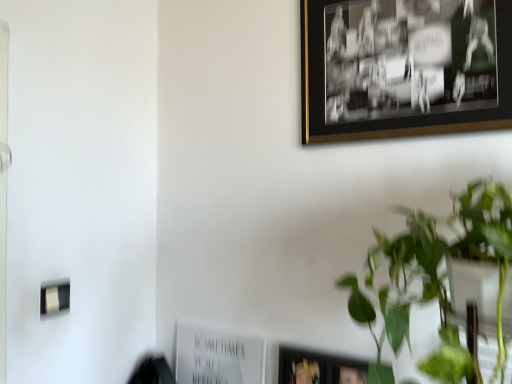
What do you see at coordinates (404, 68) in the screenshot? The width and height of the screenshot is (512, 384). I see `black/golden frame at upper right, marked as the 1th picture frame in a front-to-back arrangement` at bounding box center [404, 68].

What is the approximate width of green leafy plant at upper right?

19.14 inches.

Find the location of `white paper at lower center, the first picture frame from the left`. white paper at lower center, the first picture frame from the left is located at coordinates (218, 357).

From the image's perspective, is black/golden frame at upper right, which ranks as the second picture frame in back-to-front order, located beneath green leafy plant at upper right?

No, from the image's perspective, black/golden frame at upper right, which ranks as the second picture frame in back-to-front order, is not beneath green leafy plant at upper right.

Is black/golden frame at upper right, which ranks as the second picture frame in back-to-front order, shorter than green leafy plant at upper right?

Yes, black/golden frame at upper right, which ranks as the second picture frame in back-to-front order, is shorter than green leafy plant at upper right.

Is point (398, 106) farther from viewer compared to point (499, 196)?

Yes, it is behind point (499, 196).

Is black/golden frame at upper right, acting as the second picture frame starting from the left, far from green leafy plant at upper right?

Actually, black/golden frame at upper right, acting as the second picture frame starting from the left, and green leafy plant at upper right are a little close together.

Is green leafy plant at upper right wider or thinner than white paper at lower center, which is the first picture frame in bottom-to-top order?

green leafy plant at upper right is wider than white paper at lower center, which is the first picture frame in bottom-to-top order.

Are green leafy plant at upper right and white paper at lower center, placed as the 2th picture frame when sorted from right to left, far apart?

green leafy plant at upper right is near white paper at lower center, placed as the 2th picture frame when sorted from right to left, not far away.

Would you say white paper at lower center, marked as the second picture frame in a top-to-bottom arrangement, is part of green leafy plant at upper right's contents?

Actually, white paper at lower center, marked as the second picture frame in a top-to-bottom arrangement, is outside green leafy plant at upper right.

How much distance is there between white paper at lower center, the first picture frame from the left, and green leafy plant at upper right?

white paper at lower center, the first picture frame from the left, is 20.98 inches away from green leafy plant at upper right.

Looking at their sizes, would you say white paper at lower center, which is the first picture frame in bottom-to-top order, is wider or thinner than green leafy plant at upper right?

In the image, white paper at lower center, which is the first picture frame in bottom-to-top order, appears to be more narrow than green leafy plant at upper right.

How different are the orientations of white paper at lower center, which is the first picture frame in bottom-to-top order, and green leafy plant at upper right in degrees?

white paper at lower center, which is the first picture frame in bottom-to-top order, and green leafy plant at upper right are facing 5.29 degrees away from each other.

Are white paper at lower center, the second picture frame when ordered from front to back, and green leafy plant at upper right far apart?

That's not correct — white paper at lower center, the second picture frame when ordered from front to back, is a little close to green leafy plant at upper right.

From a real-world perspective, is green leafy plant at upper right physically located above or below black/golden frame at upper right, which is the second picture frame from bottom to top?

green leafy plant at upper right is below black/golden frame at upper right, which is the second picture frame from bottom to top.

Is green leafy plant at upper right next to black/golden frame at upper right, acting as the second picture frame starting from the left?

green leafy plant at upper right is not next to black/golden frame at upper right, acting as the second picture frame starting from the left, and they're not touching.

Which is behind, green leafy plant at upper right or black/golden frame at upper right, which is the 1th picture frame in top-to-bottom order?

Positioned behind is black/golden frame at upper right, which is the 1th picture frame in top-to-bottom order.

From the image's perspective, is green leafy plant at upper right positioned above or below black/golden frame at upper right, which ranks as the second picture frame in back-to-front order?

From the image's perspective, green leafy plant at upper right appears below black/golden frame at upper right, which ranks as the second picture frame in back-to-front order.

Is black/golden frame at upper right, marked as the 1th picture frame in a front-to-back arrangement, not close to white paper at lower center, the second picture frame when ordered from front to back?

No, black/golden frame at upper right, marked as the 1th picture frame in a front-to-back arrangement, is not far away from white paper at lower center, the second picture frame when ordered from front to back.

Considering the relative sizes of black/golden frame at upper right, which ranks as the second picture frame in back-to-front order, and white paper at lower center, which ranks as the first picture frame in back-to-front order, in the image provided, is black/golden frame at upper right, which ranks as the second picture frame in back-to-front order, shorter than white paper at lower center, which ranks as the first picture frame in back-to-front order,?

No, black/golden frame at upper right, which ranks as the second picture frame in back-to-front order, is not shorter than white paper at lower center, which ranks as the first picture frame in back-to-front order.

Does point (447, 93) come in front of point (204, 371)?

Yes, it is.

Considering the positions of objects black/golden frame at upper right, marked as the 1th picture frame in a front-to-back arrangement, and white paper at lower center, the second picture frame when ordered from front to back, in the image provided, who is more to the left, black/golden frame at upper right, marked as the 1th picture frame in a front-to-back arrangement, or white paper at lower center, the second picture frame when ordered from front to back,?

white paper at lower center, the second picture frame when ordered from front to back, is more to the left.

Which is closer to the camera, (183,367) or (430,68)?

Point (183,367).

Which object is further away from the camera taking this photo, white paper at lower center, which is the first picture frame in bottom-to-top order, or black/golden frame at upper right, marked as the 1th picture frame in a front-to-back arrangement?

white paper at lower center, which is the first picture frame in bottom-to-top order.

From a real-world perspective, does white paper at lower center, the first picture frame from the left, stand above black/golden frame at upper right, which is the second picture frame from bottom to top?

Actually, white paper at lower center, the first picture frame from the left, is physically below black/golden frame at upper right, which is the second picture frame from bottom to top, in the real world.

Based on the photo, is white paper at lower center, which is the first picture frame in bottom-to-top order, thinner than black/golden frame at upper right, acting as the second picture frame starting from the left?

Incorrect, the width of white paper at lower center, which is the first picture frame in bottom-to-top order, is not less than that of black/golden frame at upper right, acting as the second picture frame starting from the left.

Starting from the green leafy plant at upper right, which picture frame is the 1st one behind? Please provide its 2D coordinates.

[(404, 68)]

I want to click on houseplant on the right of white paper at lower center, placed as the 2th picture frame when sorted from right to left, so click(x=443, y=276).

Based on their spatial positions, is black/golden frame at upper right, acting as the second picture frame starting from the left, or white paper at lower center, placed as the 2th picture frame when sorted from right to left, further from green leafy plant at upper right?

Among the two, white paper at lower center, placed as the 2th picture frame when sorted from right to left, is located further to green leafy plant at upper right.

Which object lies nearer to the anchor point black/golden frame at upper right, acting as the second picture frame starting from the left, green leafy plant at upper right or white paper at lower center, the first picture frame from the left?

green leafy plant at upper right is closer to black/golden frame at upper right, acting as the second picture frame starting from the left.

Which object lies further to the anchor point white paper at lower center, placed as the 2th picture frame when sorted from right to left, green leafy plant at upper right or black/golden frame at upper right, which ranks as the second picture frame in back-to-front order?

Based on the image, black/golden frame at upper right, which ranks as the second picture frame in back-to-front order, appears to be further to white paper at lower center, placed as the 2th picture frame when sorted from right to left.

Which object lies further to the anchor point white paper at lower center, which is the first picture frame in bottom-to-top order, black/golden frame at upper right, which is the 1th picture frame in top-to-bottom order, or green leafy plant at upper right?

black/golden frame at upper right, which is the 1th picture frame in top-to-bottom order, is further to white paper at lower center, which is the first picture frame in bottom-to-top order.

Which object lies nearer to the anchor point black/golden frame at upper right, the 1th picture frame viewed from the right, white paper at lower center, which ranks as the first picture frame in back-to-front order, or green leafy plant at upper right?

green leafy plant at upper right lies closer to black/golden frame at upper right, the 1th picture frame viewed from the right, than the other object.

Looking at the image, which one is located closer to green leafy plant at upper right, white paper at lower center, the first picture frame from the left, or black/golden frame at upper right, the 1th picture frame viewed from the right?

black/golden frame at upper right, the 1th picture frame viewed from the right, lies closer to green leafy plant at upper right than the other object.

You are a GUI agent. You are given a task and a screenshot of the screen. Output one action in this format:
    pyautogui.click(x=<x>, y=<y>)
    Task: Click on the houseplant between black/golden frame at upper right, which is the 1th picture frame in top-to-bottom order, and white paper at lower center, placed as the 2th picture frame when sorted from right to left, from top to bottom
    
    Given the screenshot: What is the action you would take?
    pyautogui.click(x=443, y=276)